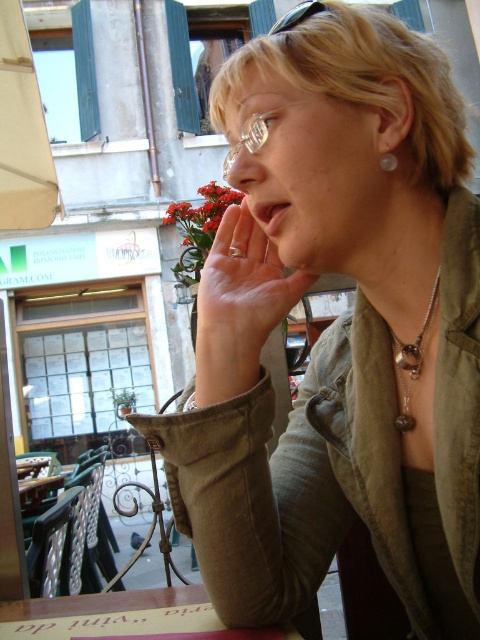
You are holding a 30 cm ruler and want to measure the distance from the camera to the point at coordinates (455, 312). Can you reach it with your ruler?

The point at coordinates (455, 312) is 54.56 centimeters from the camera. Since your ruler is only 30 cm long, you cannot reach it with your ruler.

Based on the photo, you are a photographer trying to capture a closeup of the woman in the scene. You want to ensure both the silver metallic necklace at center and the matte skin nose at center are clearly visible. Is there any potential issue with the positioning of these two objects that might cause one to block the other in the photo?

The matte skin nose at center is behind the silver metallic necklace at center, so the necklace may partially or fully block the nose in the photo, making it less visible. Adjust the angle or position to ensure both are clearly visible.